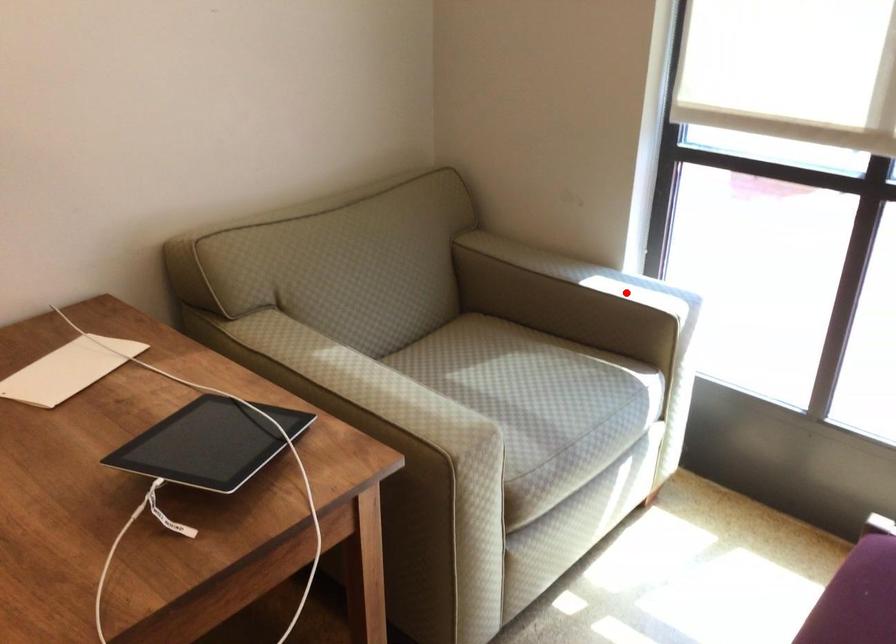
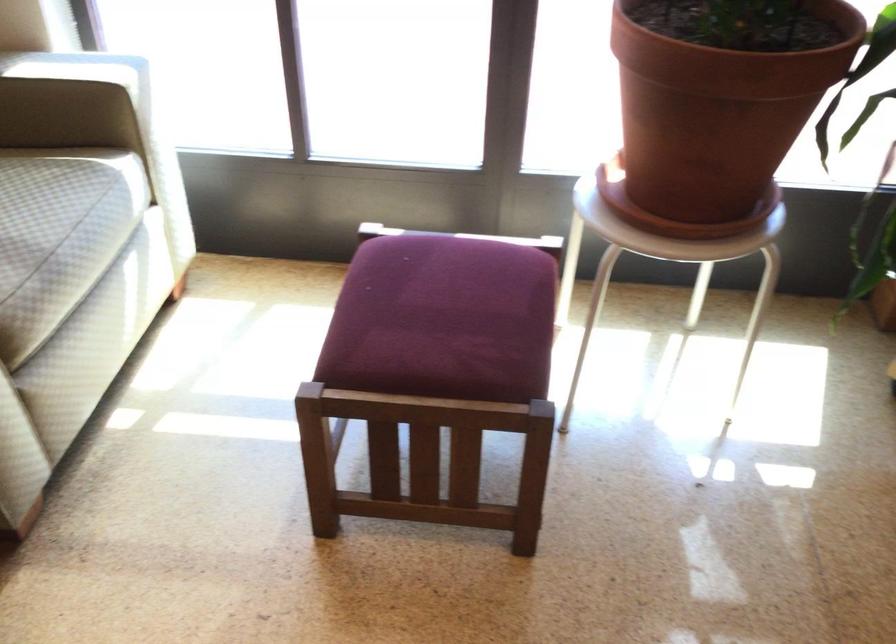
In the second image, find the point that corresponds to the highlighted location in the first image.

(73, 69)